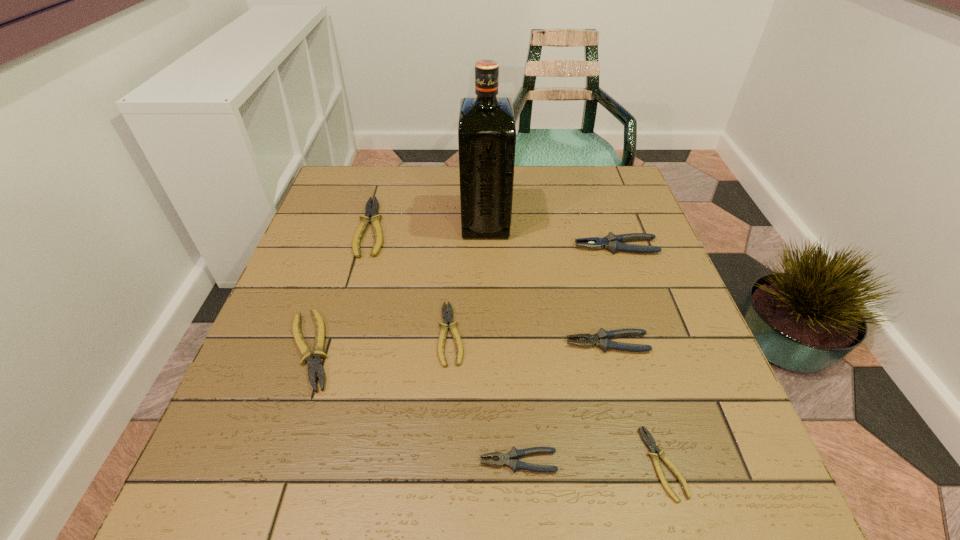
Locate an element on the screen. The height and width of the screenshot is (540, 960). object that is at the far left corner is located at coordinates (371, 212).

This screenshot has width=960, height=540. In order to click on object located at the near right corner in this screenshot , I will do `click(650, 443)`.

This screenshot has height=540, width=960. I want to click on free location at the far edge of the desktop, so click(x=399, y=194).

In the image, there is a desktop. Where is `vacant space at the near edge`? The height and width of the screenshot is (540, 960). vacant space at the near edge is located at coordinates (522, 476).

Locate an element on the screen. The width and height of the screenshot is (960, 540). blank space at the left edge is located at coordinates 234,460.

Locate an element on the screen. vacant region at the right edge of the desktop is located at coordinates (660, 312).

The image size is (960, 540). In order to click on vacant area at the far left corner in this screenshot , I will do `click(354, 194)`.

Where is `vacant space at the near left corner`? The height and width of the screenshot is (540, 960). vacant space at the near left corner is located at coordinates (265, 470).

Locate an element on the screen. The width and height of the screenshot is (960, 540). empty space between the second biggest yellow pliers and the farthest yellow pliers is located at coordinates (341, 289).

The width and height of the screenshot is (960, 540). What are the coordinates of `empty space that is in between the liquor and the third biggest yellow pliers` in the screenshot? It's located at (468, 278).